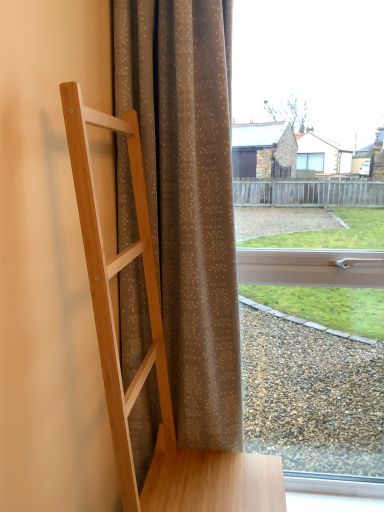
Question: From a real-world perspective, is natural wood ladder at left physically located above or below transparent glass window at center?

Choices:
 (A) below
 (B) above

Answer: (A)

Question: Based on their sizes in the image, would you say natural wood ladder at left is bigger or smaller than transparent glass window at center?

Choices:
 (A) small
 (B) big

Answer: (B)

Question: Based on their relative distances, which object is farther from the transparent glass window at center?

Choices:
 (A) brown sheer curtain at center
 (B) natural wood ladder at left

Answer: (B)

Question: Based on their relative distances, which object is farther from the brown sheer curtain at center?

Choices:
 (A) natural wood ladder at left
 (B) transparent glass window at center

Answer: (B)